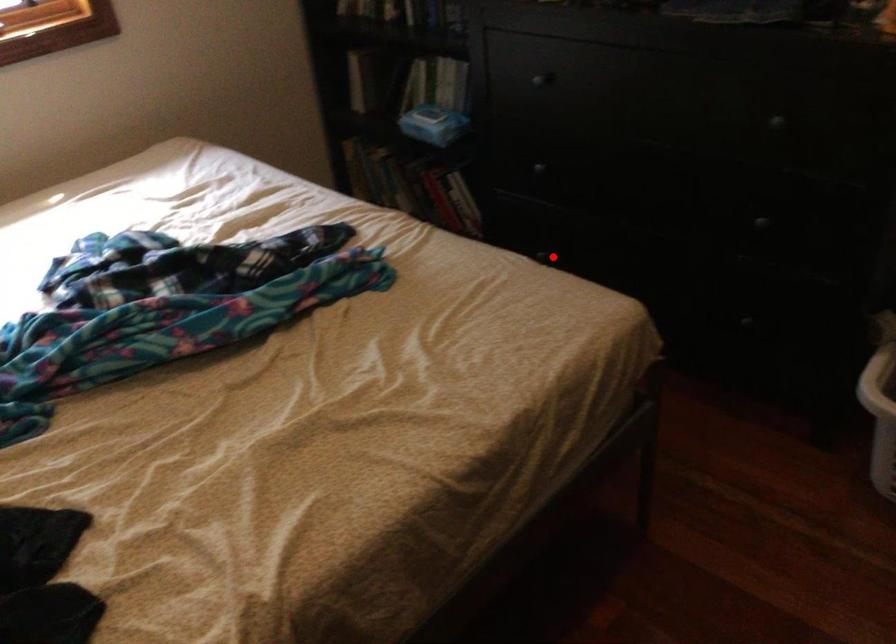
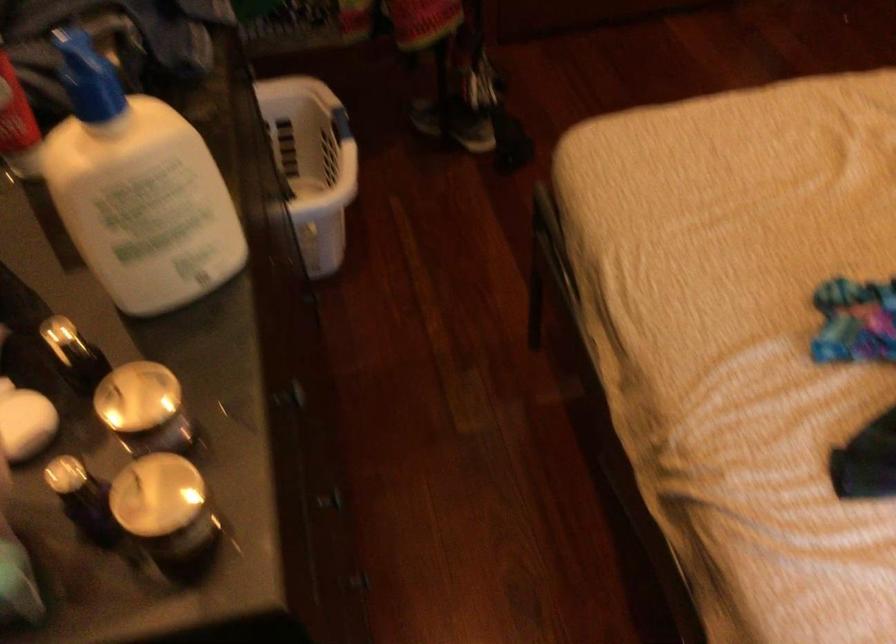
Question: I am providing you with two images of the same scene from different viewpoints. A red point is shown in image1. For the corresponding object point in image2, is it positioned nearer or farther from the camera?

Choices:
 (A) Nearer
 (B) Farther

Answer: (A)